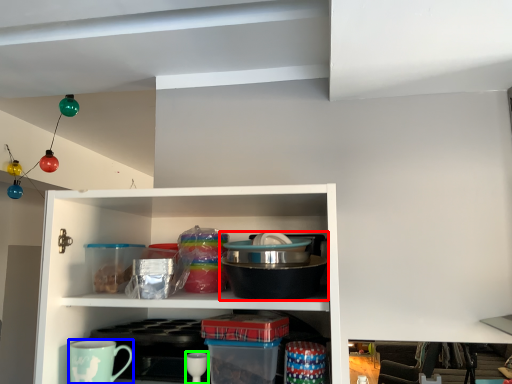
Question: Which object is the farthest from appliance (highlighted by a red box)? Choose among these: coffee cup (highlighted by a blue box) or tableware (highlighted by a green box).

Choices:
 (A) coffee cup
 (B) tableware

Answer: (A)